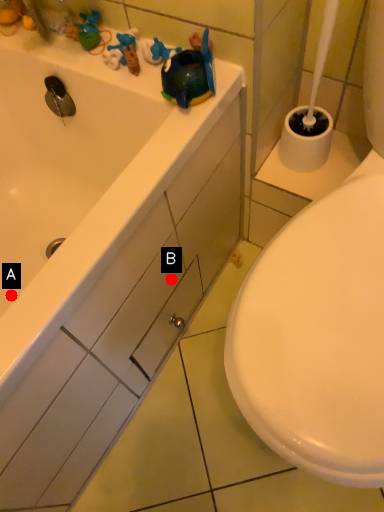
Question: Two points are circled on the image, labeled by A and B beside each circle. Which of the following is the farthest from the observer?

Choices:
 (A) A is further
 (B) B is further

Answer: (A)